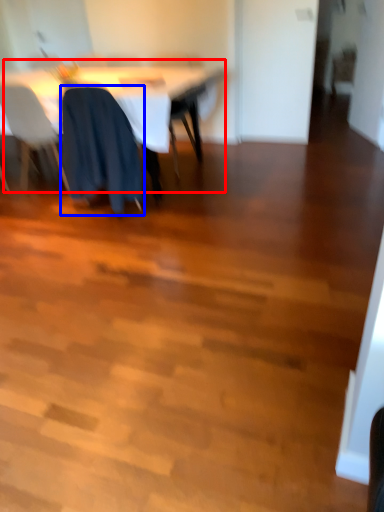
Question: Which object is closer to the camera taking this photo, table (highlighted by a red box) or chair (highlighted by a blue box)?

Choices:
 (A) table
 (B) chair

Answer: (B)